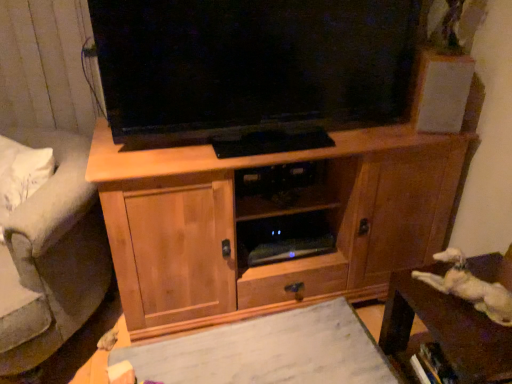
Image resolution: width=512 pixels, height=384 pixels. In order to click on gray fabric armchair at left in this screenshot , I will do `click(51, 257)`.

What do you see at coordinates (268, 221) in the screenshot? I see `wooden cabinet at center` at bounding box center [268, 221].

Identify the location of white fluffy cat at lower right. Image resolution: width=512 pixels, height=384 pixels. (470, 287).

Considering the points (460, 351) and (409, 220), which point is in front, point (460, 351) or point (409, 220)?

The point (460, 351) is more forward.

From the image's perspective, is brown wooden table at lower right positioned above or below wooden cabinet at center?

brown wooden table at lower right is situated lower than wooden cabinet at center in the image.

Where is `armchair located in front of the white fluffy cat at lower right`? The width and height of the screenshot is (512, 384). armchair located in front of the white fluffy cat at lower right is located at coordinates (51, 257).

Is gray fabric armchair at left touching white fluffy cat at lower right?

No, gray fabric armchair at left is not in contact with white fluffy cat at lower right.

In the image, is gray fabric armchair at left on the left side or the right side of white fluffy cat at lower right?

Based on their positions, gray fabric armchair at left is located to the left of white fluffy cat at lower right.

Is brown wooden table at lower right at the right side of white matte paper at center?

Correct, you'll find brown wooden table at lower right to the right of white matte paper at center.

Can you confirm if brown wooden table at lower right is bigger than white matte paper at center?

Incorrect, brown wooden table at lower right is not larger than white matte paper at center.

The height and width of the screenshot is (384, 512). In order to click on furniture above the white matte paper at center (from the image's perspective) in this screenshot , I will do [x=445, y=332].

Is brown wooden table at lower right facing towards white matte paper at center?

Yes, brown wooden table at lower right is facing white matte paper at center.

Based on the photo, are brown wooden table at lower right and white matte speaker at upper right located far from each other?

No, there isn't a large distance between brown wooden table at lower right and white matte speaker at upper right.

From the image's perspective, who appears lower, brown wooden table at lower right or white matte speaker at upper right?

From the image's view, brown wooden table at lower right is below.

At what (x,y) coordinates should I click in order to perform the action: click on speaker behind the brown wooden table at lower right. Please return your answer as a coordinate pair (x, y). This screenshot has height=384, width=512. Looking at the image, I should click on (441, 92).

Who is bigger, white matte paper at center or white matte speaker at upper right?

Bigger between the two is white matte paper at center.

Looking at this image, from the image's perspective, between white matte paper at center and white matte speaker at upper right, who is located below?

white matte paper at center, from the image's perspective.

Between white matte paper at center and white matte speaker at upper right, which one has smaller width?

white matte speaker at upper right.

Would you say white matte paper at center contains white matte speaker at upper right?

Definitely not — white matte speaker at upper right is not inside white matte paper at center.

Which is more to the left, white matte speaker at upper right or white fluffy cat at lower right?

From the viewer's perspective, white fluffy cat at lower right appears more on the left side.

From the image's perspective, is white matte speaker at upper right on white fluffy cat at lower right?

Yes.

Between white matte speaker at upper right and white fluffy cat at lower right, which one is positioned behind?

white matte speaker at upper right is further from the camera.

Can you see white matte paper at center touching wooden cabinet at center?

No, white matte paper at center is not next to wooden cabinet at center.

Is white matte paper at center positioned with its back to wooden cabinet at center?

That's right, white matte paper at center is facing away from wooden cabinet at center.

Is white matte paper at center taller than wooden cabinet at center?

In fact, white matte paper at center may be shorter than wooden cabinet at center.

Locate an element on the screen. This screenshot has width=512, height=384. furniture that appears on the right of wooden cabinet at center is located at coordinates click(445, 332).

You are a GUI agent. You are given a task and a screenshot of the screen. Output one action in this format:
    pyautogui.click(x=<x>, y=<y>)
    Task: Click on the animal above the gray fabric armchair at left (from a real-world perspective)
    This screenshot has width=512, height=384.
    Given the screenshot: What is the action you would take?
    pyautogui.click(x=470, y=287)

Based on their spatial positions, is white matte speaker at upper right or white fluffy cat at lower right closer to white matte paper at center?

white fluffy cat at lower right is positioned closer to the anchor white matte paper at center.

When comparing their distances from gray fabric armchair at left, does white matte speaker at upper right or brown wooden table at lower right seem closer?

The object closer to gray fabric armchair at left is brown wooden table at lower right.

From the image, which object appears to be farther from white fluffy cat at lower right, white matte speaker at upper right or gray fabric armchair at left?

The object further to white fluffy cat at lower right is gray fabric armchair at left.

Based on their spatial positions, is wooden cabinet at center or white matte paper at center closer to gray fabric armchair at left?

wooden cabinet at center is closer to gray fabric armchair at left.

Considering their positions, is white matte paper at center positioned further to white fluffy cat at lower right than white matte speaker at upper right?

white matte speaker at upper right lies further to white fluffy cat at lower right than the other object.

When comparing their distances from gray fabric armchair at left, does wooden cabinet at center or white fluffy cat at lower right seem closer?

wooden cabinet at center.

Consider the image. Considering their positions, is white fluffy cat at lower right positioned closer to gray fabric armchair at left than white matte speaker at upper right?

white fluffy cat at lower right is closer to gray fabric armchair at left.

Based on their spatial positions, is wooden cabinet at center or gray fabric armchair at left further from brown wooden table at lower right?

The object further to brown wooden table at lower right is gray fabric armchair at left.

Where is `plain between gray fabric armchair at left and white matte speaker at upper right from left to right`? The width and height of the screenshot is (512, 384). plain between gray fabric armchair at left and white matte speaker at upper right from left to right is located at coordinates (269, 351).

I want to click on animal between gray fabric armchair at left and white matte speaker at upper right in the horizontal direction, so click(x=470, y=287).

This screenshot has width=512, height=384. Find the location of `plain situated between gray fabric armchair at left and white fluffy cat at lower right from left to right`. plain situated between gray fabric armchair at left and white fluffy cat at lower right from left to right is located at coordinates (269, 351).

This screenshot has width=512, height=384. I want to click on cabinetry between gray fabric armchair at left and white fluffy cat at lower right in the horizontal direction, so click(268, 221).